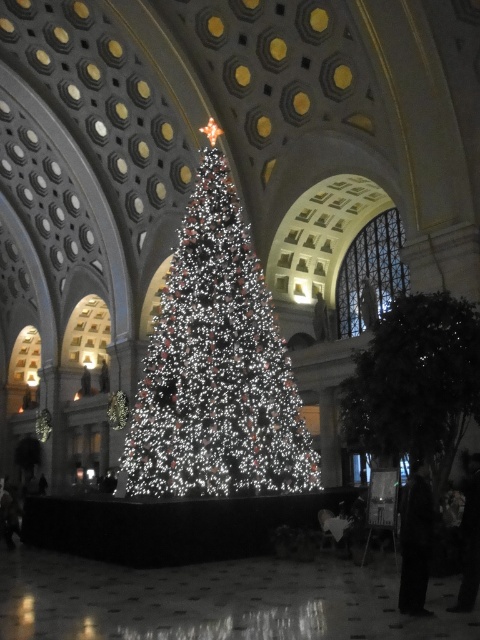
Question: Which of the following is the farthest from the observer?

Choices:
 (A) illuminated plastic christmas tree at center
 (B) green matte tree at right

Answer: (A)

Question: Does illuminated plastic christmas tree at center appear over green matte tree at right?

Choices:
 (A) yes
 (B) no

Answer: (A)

Question: Does illuminated plastic christmas tree at center have a larger size compared to green matte tree at right?

Choices:
 (A) yes
 (B) no

Answer: (A)

Question: Is illuminated plastic christmas tree at center to the left of green matte tree at right from the viewer's perspective?

Choices:
 (A) no
 (B) yes

Answer: (B)